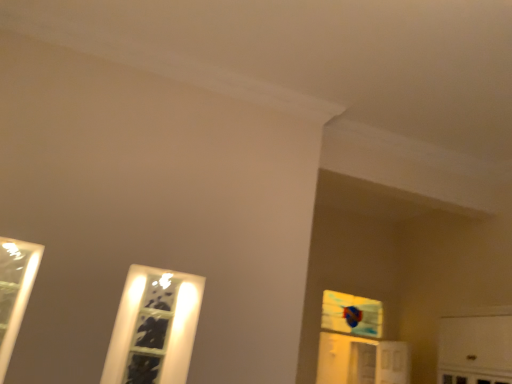
What do you see at coordinates (351, 314) in the screenshot? I see `matte glass window at upper right` at bounding box center [351, 314].

Where is `matte glass window at upper right`? matte glass window at upper right is located at coordinates (351, 314).

Measure the distance between point (357, 307) and camera.

Point (357, 307) is 5.41 meters away from camera.

Image resolution: width=512 pixels, height=384 pixels. I want to click on matte glass window at upper right, so (351, 314).